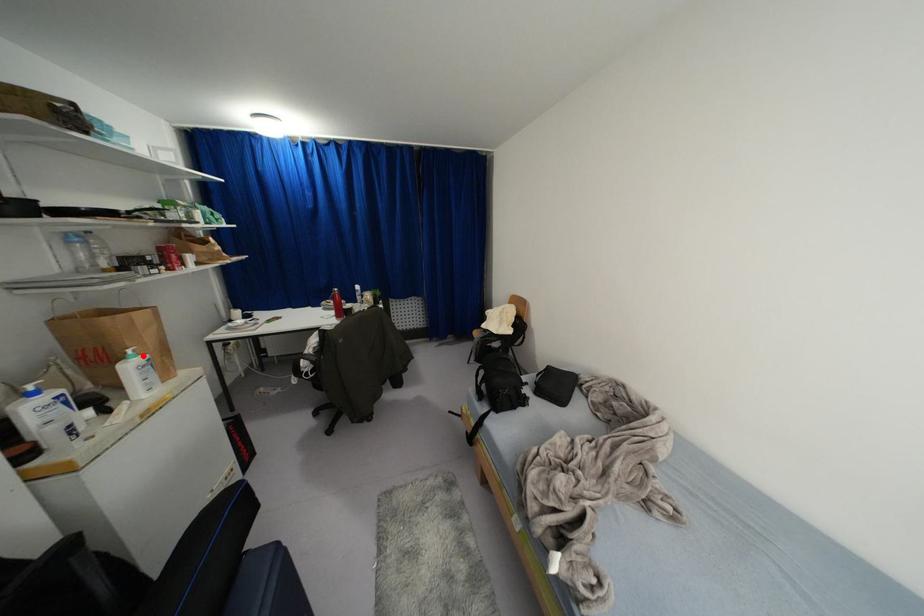
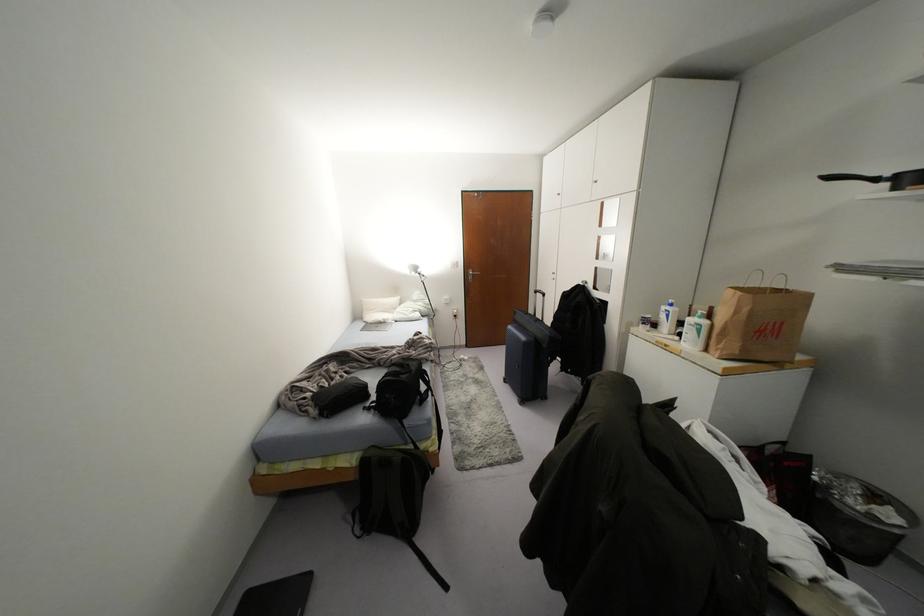
Question: I am providing you with two images of the same scene from different viewpoints. Given a red point in image1, look at the same physical point in image2. Is it:

Choices:
 (A) Closer to the viewpoint
 (B) Farther from the viewpoint

Answer: (A)